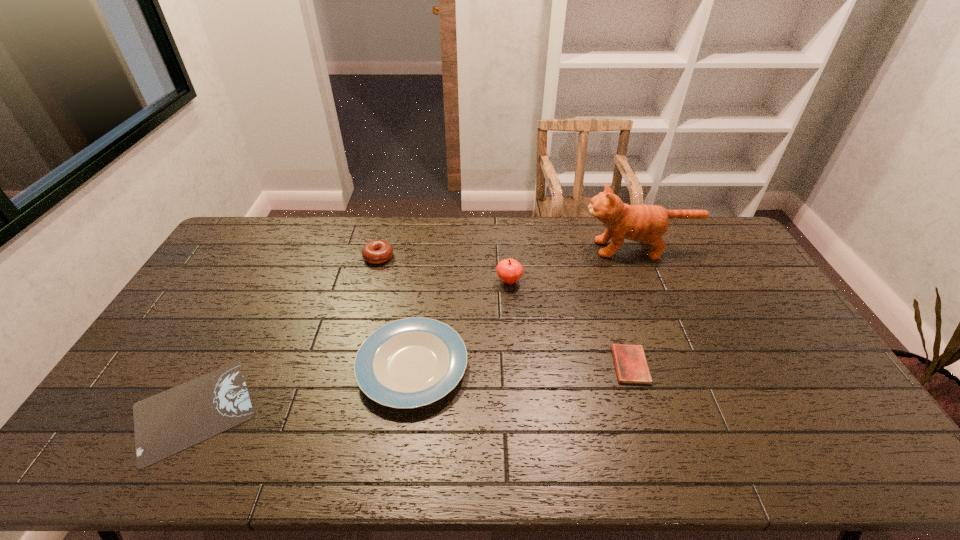
You are a GUI agent. You are given a task and a screenshot of the screen. Output one action in this format:
    pyautogui.click(x=<x>, y=<y>)
    Task: Click on the vacant space that satisfies the following two spatial constraints: 1. on the front side of the fourth shortest object; 2. on the left side of the fifth tallest object
    This screenshot has height=540, width=960.
    Given the screenshot: What is the action you would take?
    pyautogui.click(x=349, y=365)

Where is `vacant point that satisfies the following two spatial constraints: 1. on the face of the cat; 2. on the front side of the shortest object`? The image size is (960, 540). vacant point that satisfies the following two spatial constraints: 1. on the face of the cat; 2. on the front side of the shortest object is located at coordinates (708, 410).

Image resolution: width=960 pixels, height=540 pixels. Identify the location of vacant region that satisfies the following two spatial constraints: 1. on the back side of the leftmost object; 2. on the left side of the second shortest object. (218, 365).

Identify the location of vacant area in the image that satisfies the following two spatial constraints: 1. on the face of the tallest object; 2. on the front side of the second tallest object. (652, 281).